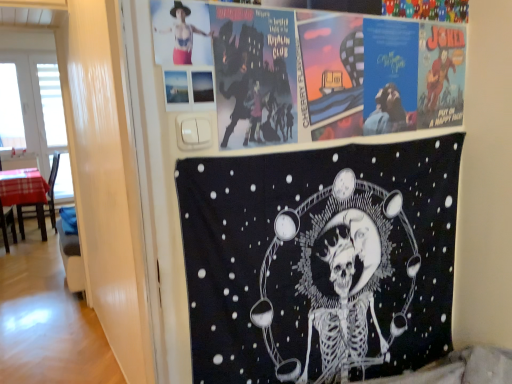
Question: Can you confirm if plaid fabric chair at left is bigger than matte black and pink fabric at upper left?

Choices:
 (A) yes
 (B) no

Answer: (A)

Question: From a real-world perspective, does plaid fabric chair at left stand above matte black and pink fabric at upper left?

Choices:
 (A) no
 (B) yes

Answer: (A)

Question: Is plaid fabric chair at left facing towards matte black and pink fabric at upper left?

Choices:
 (A) yes
 (B) no

Answer: (B)

Question: From the image's perspective, is plaid fabric chair at left below matte black and pink fabric at upper left?

Choices:
 (A) yes
 (B) no

Answer: (A)

Question: From a real-world perspective, is plaid fabric chair at left located beneath matte black and pink fabric at upper left?

Choices:
 (A) no
 (B) yes

Answer: (B)

Question: Is matte black and pink fabric at upper left bigger or smaller than white plastic window screen at left?

Choices:
 (A) small
 (B) big

Answer: (A)

Question: From a real-world perspective, is matte black and pink fabric at upper left physically located above or below white plastic window screen at left?

Choices:
 (A) above
 (B) below

Answer: (A)

Question: Is matte black and pink fabric at upper left inside the boundaries of white plastic window screen at left, or outside?

Choices:
 (A) outside
 (B) inside

Answer: (A)

Question: In the image, is matte black and pink fabric at upper left positioned in front of or behind white plastic window screen at left?

Choices:
 (A) front
 (B) behind

Answer: (A)

Question: Is matte paper poster at upper center, positioned as the first poster in top-to-bottom order, bigger or smaller than plaid fabric chair at left?

Choices:
 (A) big
 (B) small

Answer: (B)

Question: Looking at their shapes, would you say matte paper poster at upper center, positioned as the first poster in top-to-bottom order, is wider or thinner than plaid fabric chair at left?

Choices:
 (A) wide
 (B) thin

Answer: (B)

Question: From the image's perspective, is matte paper poster at upper center, the second poster when ordered from bottom to top, located above or below plaid fabric chair at left?

Choices:
 (A) above
 (B) below

Answer: (A)

Question: Considering the positions of matte paper poster at upper center, positioned as the first poster in top-to-bottom order, and plaid fabric chair at left in the image, is matte paper poster at upper center, positioned as the first poster in top-to-bottom order, taller or shorter than plaid fabric chair at left?

Choices:
 (A) tall
 (B) short

Answer: (B)

Question: Considering the positions of matte black and pink fabric at upper left and plaid fabric chair at left in the image, is matte black and pink fabric at upper left taller or shorter than plaid fabric chair at left?

Choices:
 (A) tall
 (B) short

Answer: (B)

Question: From a real-world perspective, is matte black and pink fabric at upper left physically located above or below plaid fabric chair at left?

Choices:
 (A) below
 (B) above

Answer: (B)